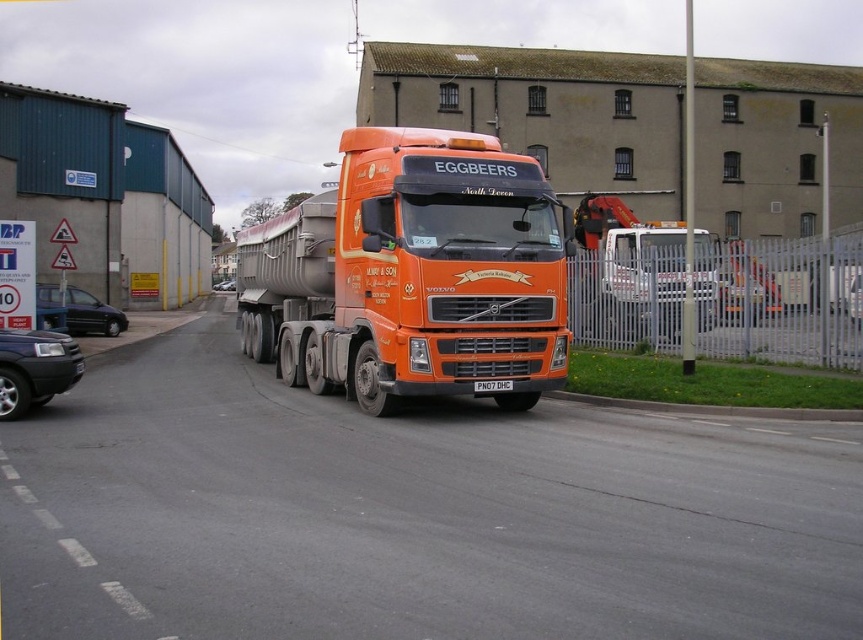
Does orange metallic truck at right have a greater width compared to metallic silver car at center?

Yes.

In the scene shown: Who is positioned more to the right, orange metallic truck at right or metallic silver car at center?

From the viewer's perspective, orange metallic truck at right appears more on the right side.

Is point (643, 292) behind point (218, 285)?

No, (643, 292) is in front of (218, 285).

Find the location of a particular element. orange metallic truck at right is located at coordinates coord(639,269).

Who is more distant from viewer, (x=502, y=385) or (x=219, y=289)?

The point (x=219, y=289) is behind.

Is point (482, 385) closer to camera compared to point (221, 284)?

That is True.

Locate an element on the screen. black plastic license plate at center is located at coordinates (492, 385).

The image size is (863, 640). Describe the element at coordinates (35, 369) in the screenshot. I see `matte black car at lower left` at that location.

In the scene shown: Which of these two, matte black car at lower left or metallic silver car at center, stands taller?

With more height is metallic silver car at center.

This screenshot has height=640, width=863. What do you see at coordinates (35, 369) in the screenshot? I see `matte black car at lower left` at bounding box center [35, 369].

I want to click on matte black car at lower left, so click(x=35, y=369).